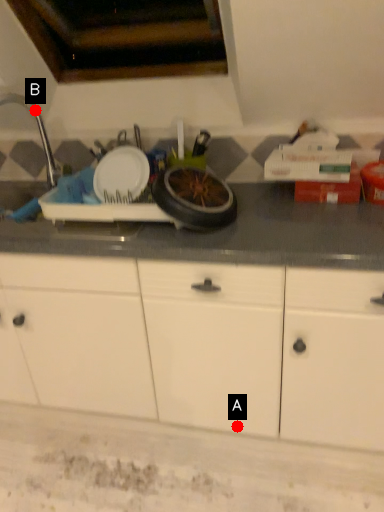
Question: Two points are circled on the image, labeled by A and B beside each circle. Which point is farther to the camera?

Choices:
 (A) A is further
 (B) B is further

Answer: (B)